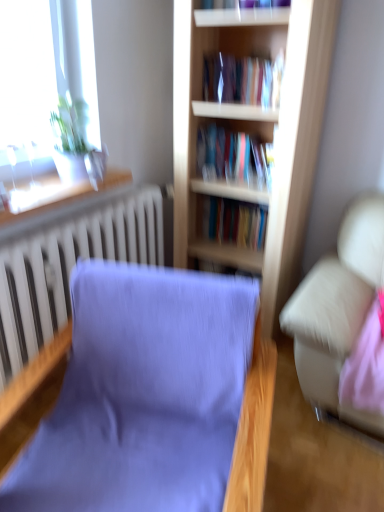
Question: Is light wood bookcase at center spatially inside white textured radiator at left, or outside of it?

Choices:
 (A) outside
 (B) inside

Answer: (A)

Question: Based on their sizes in the image, would you say light wood bookcase at center is bigger or smaller than white textured radiator at left?

Choices:
 (A) small
 (B) big

Answer: (B)

Question: Which object is the farthest from the light wood bookcase at center?

Choices:
 (A) white textured radiator at left
 (B) wooden window sill at upper left
 (C) purple fabric chair at center

Answer: (C)

Question: Which object is the closest to the white textured radiator at left?

Choices:
 (A) purple fabric chair at center
 (B) light wood bookcase at center
 (C) wooden window sill at upper left

Answer: (C)